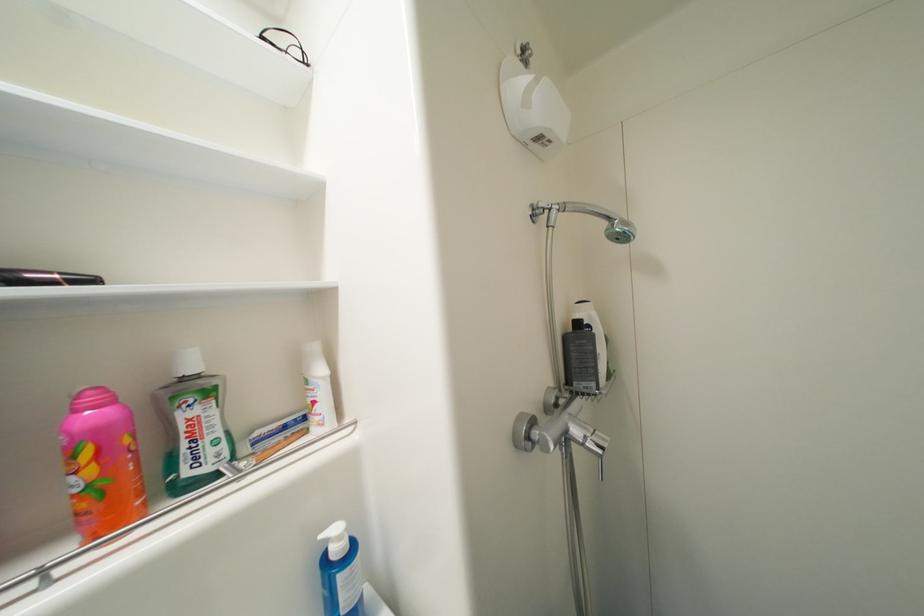
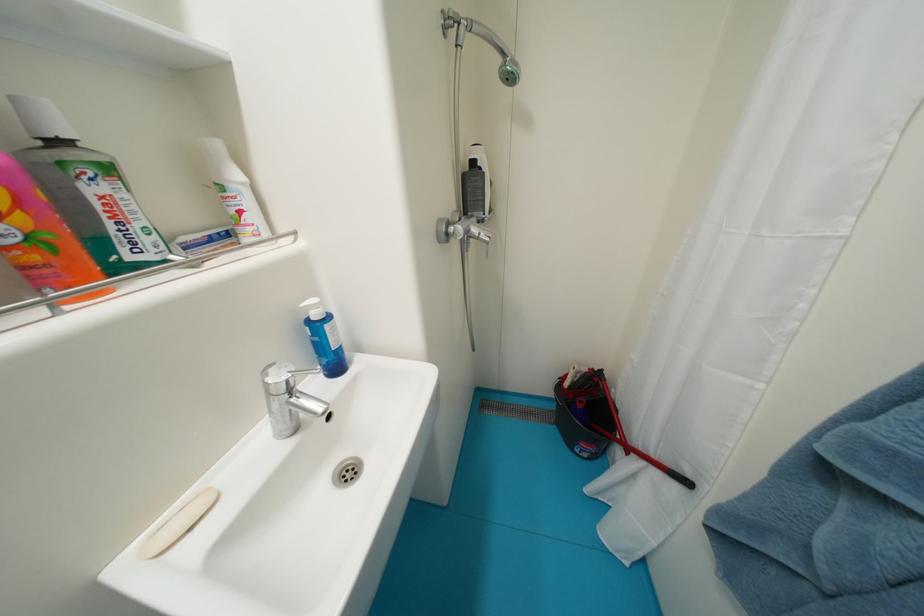
Based on the continuous images, in which direction is the camera rotating?

The camera rotated toward right-down.